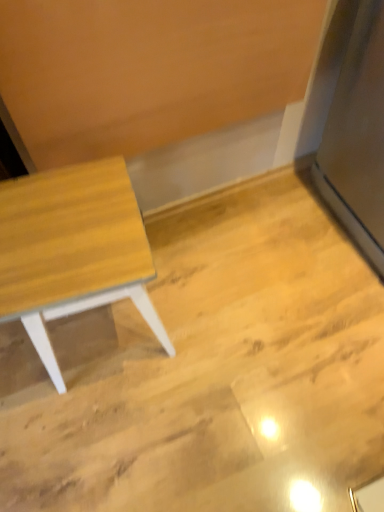
Image resolution: width=384 pixels, height=512 pixels. Find the location of `vacant area located to the right-hand side of light wood table at left`. vacant area located to the right-hand side of light wood table at left is located at coordinates (203, 318).